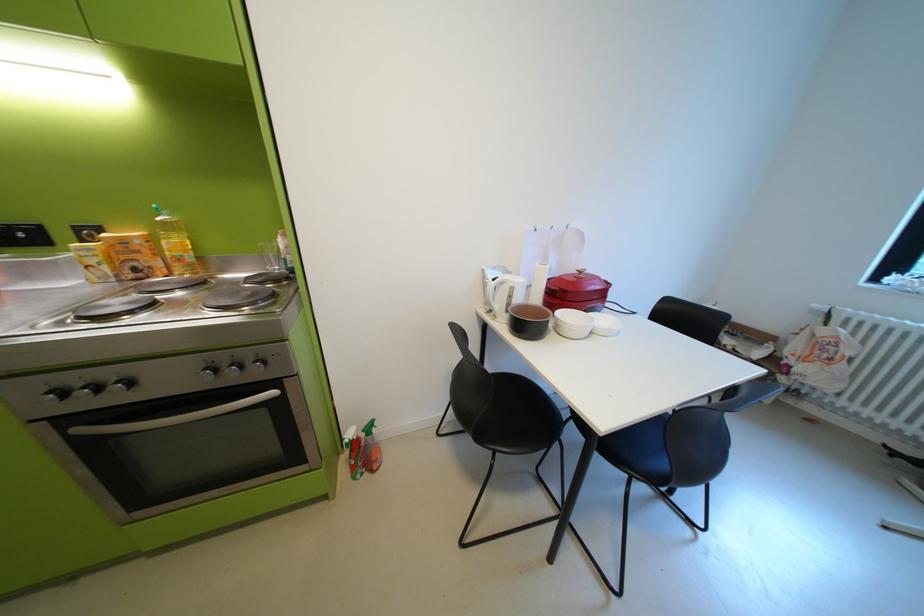
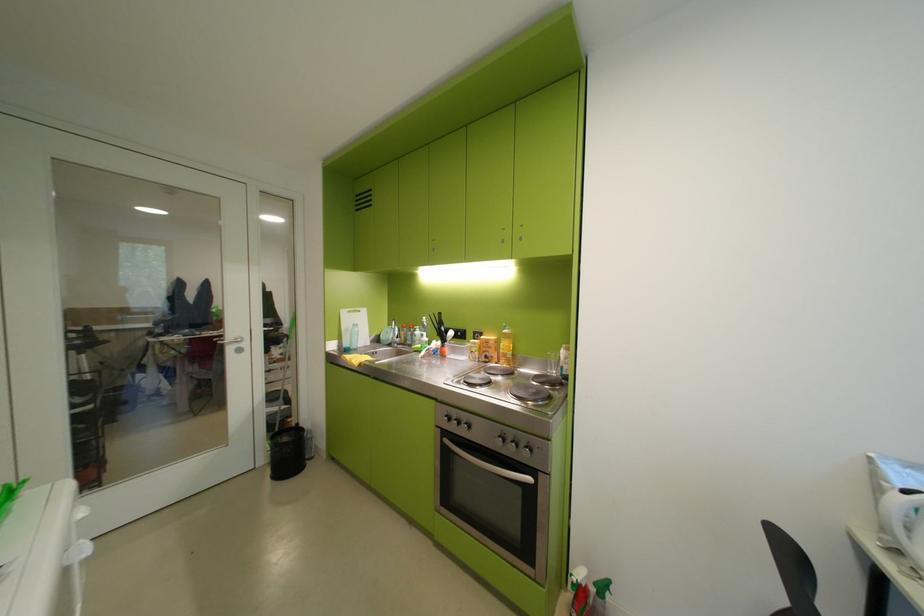
The point at (74, 394) is marked in the first image. Where is the corresponding point in the second image?

(459, 419)